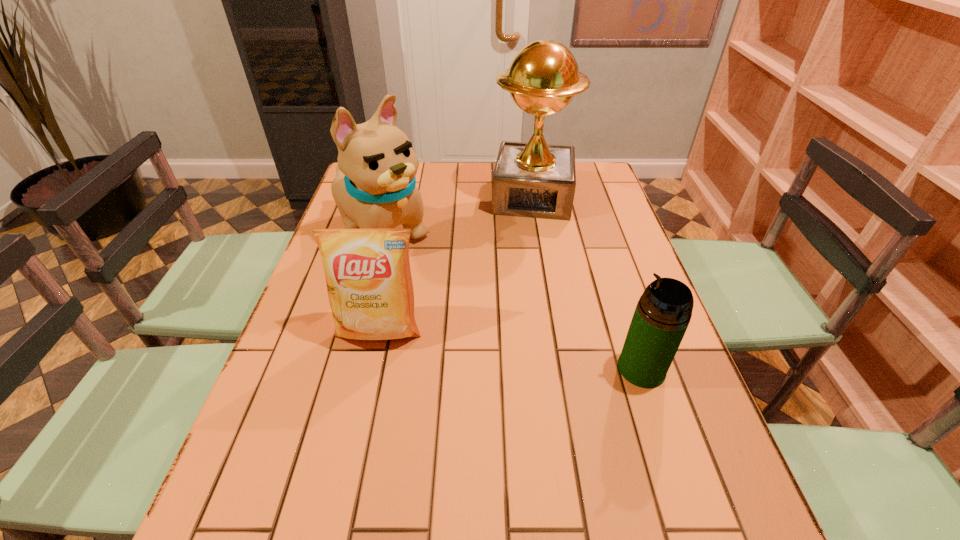
I want to click on vacant space at the far edge of the desktop, so (422, 161).

Identify the location of vacant position at the near edge of the desktop. (590, 468).

I want to click on vacant space at the left edge, so click(292, 327).

In order to click on vacant space at the right edge of the desktop in this screenshot , I will do `click(595, 283)`.

You are a GUI agent. You are given a task and a screenshot of the screen. Output one action in this format:
    pyautogui.click(x=<x>, y=<y>)
    Task: Click on the free space between the award and the thermos bottle
    The image size is (960, 540).
    Given the screenshot: What is the action you would take?
    [587, 283]

The width and height of the screenshot is (960, 540). I want to click on empty space between the award and the crisp (potato chip), so click(x=456, y=264).

Identify the location of vacant area that lies between the crisp (potato chip) and the award. The image size is (960, 540). (456, 264).

Locate an element on the screen. vacant space in between the thermos bottle and the crisp (potato chip) is located at coordinates (511, 349).

The image size is (960, 540). In order to click on blank region between the third shortest object and the award in this screenshot , I will do `click(457, 215)`.

This screenshot has width=960, height=540. I want to click on empty location between the thermos bottle and the crisp (potato chip), so click(511, 349).